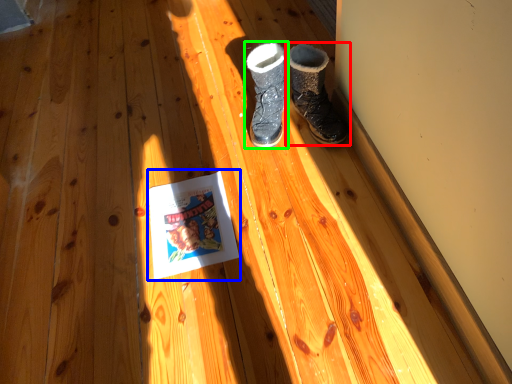
Question: Which is farther away from footwear (highlighted by a red box)? paperback book (highlighted by a blue box) or footwear (highlighted by a green box)?

Choices:
 (A) paperback book
 (B) footwear

Answer: (A)